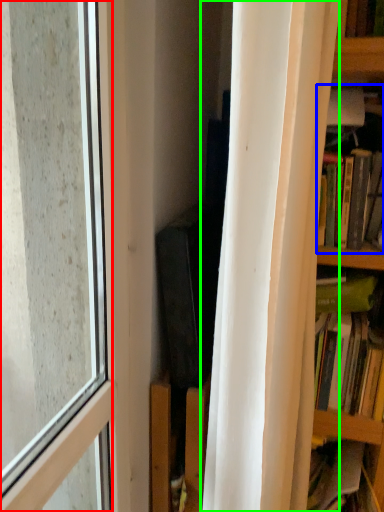
Question: Which is farther away from window (highlighted by a red box)? book (highlighted by a blue box) or curtain (highlighted by a green box)?

Choices:
 (A) book
 (B) curtain

Answer: (A)